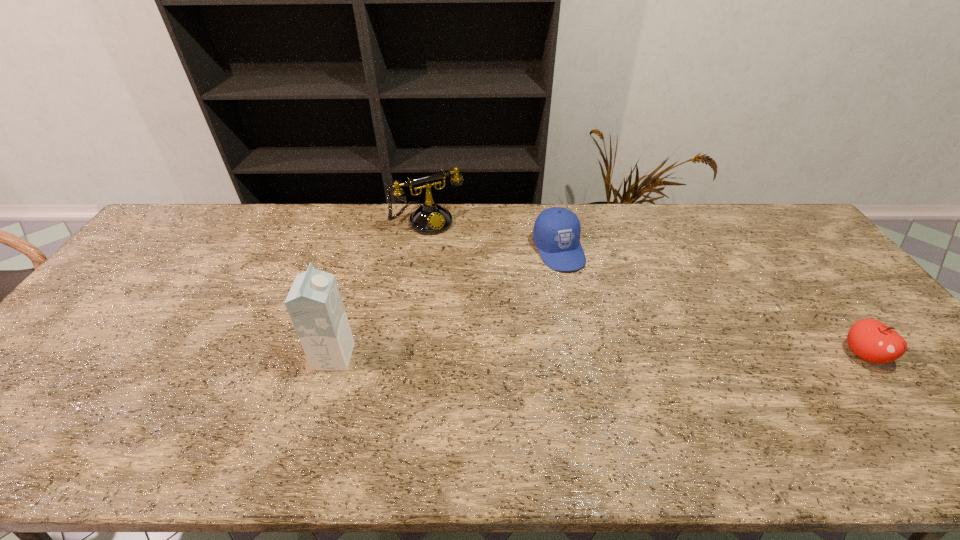
At what (x,y) coordinates should I click in order to perform the action: click on the tallest object. Please return your answer as a coordinate pair (x, y). Looking at the image, I should click on (314, 303).

Locate an element on the screen. the leftmost object is located at coordinates (314, 303).

The image size is (960, 540). Identify the location of apple. (871, 340).

Where is `the third object from left to right`? This screenshot has height=540, width=960. the third object from left to right is located at coordinates (556, 234).

Find the location of a particular element. The height and width of the screenshot is (540, 960). telephone is located at coordinates (430, 218).

This screenshot has height=540, width=960. I want to click on the third shortest object, so click(430, 218).

You are a GUI agent. You are given a task and a screenshot of the screen. Output one action in this format:
    pyautogui.click(x=<x>, y=<y>)
    Task: Click on the free spot located 0.330m on the front label of the tallest object
    This screenshot has height=540, width=960.
    Given the screenshot: What is the action you would take?
    pyautogui.click(x=482, y=356)

Locate an element on the screen. The image size is (960, 540). vacant region located on the back of the apple is located at coordinates (828, 309).

This screenshot has width=960, height=540. Identify the location of vacant space located 0.350m on the front-facing side of the third object from left to right. click(x=624, y=365).

The image size is (960, 540). What are the coordinates of `vacant position located on the front-facing side of the third object from left to right` in the screenshot? It's located at (599, 324).